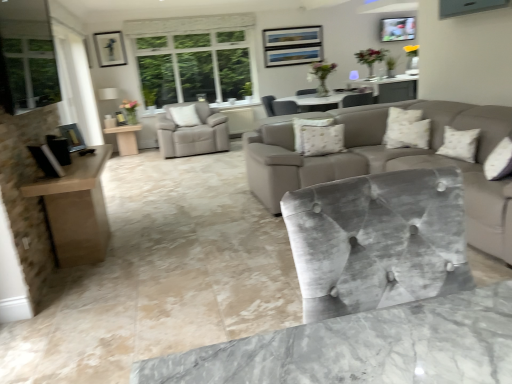
What is the approximate height of clear glass window at left?

clear glass window at left is 85.98 centimeters in height.

This screenshot has height=384, width=512. Describe the element at coordinates (185, 116) in the screenshot. I see `beige fabric pillow at center, positioned as the 1th pillow in back-to-front order` at that location.

Describe the element at coordinates (193, 133) in the screenshot. I see `light beige leather armchair at center, which is the 3th chair in bottom-to-top order` at that location.

In order to face metallic silver picture frame at upper right, which is the 2th picture frame in front-to-back order, should I rotate leftwards or rightwards?

Turn right approximately 18.273 degrees to face it.

Where is `matte beige table at center`? Image resolution: width=512 pixels, height=384 pixels. matte beige table at center is located at coordinates (125, 138).

What do you see at coordinates (125, 138) in the screenshot? This screenshot has height=384, width=512. I see `matte beige table at center` at bounding box center [125, 138].

Locate an element on the screen. This screenshot has height=384, width=512. clear glass window at left is located at coordinates (31, 72).

From a real-world perspective, which is physically below, velvet grey chair at center, the 2th chair when ordered from front to back, or white textured pillow at center, which is the second pillow in front-to-back order?

white textured pillow at center, which is the second pillow in front-to-back order.

Considering the sizes of velvet grey chair at center, the 2th chair when ordered from front to back, and white textured pillow at center, the third pillow in the top-to-bottom sequence, in the image, is velvet grey chair at center, the 2th chair when ordered from front to back, taller or shorter than white textured pillow at center, the third pillow in the top-to-bottom sequence,?

Clearly, velvet grey chair at center, the 2th chair when ordered from front to back, is shorter compared to white textured pillow at center, the third pillow in the top-to-bottom sequence.

Could you tell me if velvet grey chair at center, placed as the 3th chair when sorted from left to right, is facing white textured pillow at center, the 2th pillow positioned from the left?

No, velvet grey chair at center, placed as the 3th chair when sorted from left to right, is not oriented towards white textured pillow at center, the 2th pillow positioned from the left.

Based on the photo, is velvet grey chair at center, positioned as the second chair in bottom-to-top order, to the right of white textured pillow at center, the first pillow when ordered from bottom to top, from the viewer's perspective?

No, velvet grey chair at center, positioned as the second chair in bottom-to-top order, is not to the right of white textured pillow at center, the first pillow when ordered from bottom to top.

Which object is more forward, velvet gray chair at center, placed as the second chair when sorted from left to right, or matte black picture frame at upper left, placed as the 1th picture frame when sorted from bottom to top?

Positioned in front is velvet gray chair at center, placed as the second chair when sorted from left to right.

From their relative heights in the image, would you say velvet gray chair at center, the 3th chair viewed from the back, is taller or shorter than matte black picture frame at upper left, arranged as the second picture frame when viewed from the back?

In the image, velvet gray chair at center, the 3th chair viewed from the back, appears to be taller than matte black picture frame at upper left, arranged as the second picture frame when viewed from the back.

Identify the location of picture frame on the left of velvet gray chair at center, arranged as the 3th chair when viewed from the top. This screenshot has height=384, width=512. coord(110,49).

Does velvet gray chair at center, which appears as the first chair when viewed from the front, turn towards matte black picture frame at upper left, which is the first picture frame in left-to-right order?

No, velvet gray chair at center, which appears as the first chair when viewed from the front, is not facing towards matte black picture frame at upper left, which is the first picture frame in left-to-right order.

Can you confirm if white textured pillow at center, the 2th pillow positioned from the left, is positioned to the right of velvet grey chair at center, the second chair in the back-to-front sequence?

Correct, you'll find white textured pillow at center, the 2th pillow positioned from the left, to the right of velvet grey chair at center, the second chair in the back-to-front sequence.

Where is `the 1st chair to the left of the white textured pillow at center, the first pillow when ordered from bottom to top, starting your count from the anchor`? This screenshot has height=384, width=512. the 1st chair to the left of the white textured pillow at center, the first pillow when ordered from bottom to top, starting your count from the anchor is located at coordinates (278, 106).

From the image's perspective, which one is positioned lower, white textured pillow at center, the third pillow in the top-to-bottom sequence, or velvet grey chair at center, the 2th chair from the top?

white textured pillow at center, the third pillow in the top-to-bottom sequence, appears lower in the image.

Considering the sizes of objects white textured pillow at center, the 2th pillow positioned from the left, and velvet grey chair at center, the second chair in the back-to-front sequence, in the image provided, who is bigger, white textured pillow at center, the 2th pillow positioned from the left, or velvet grey chair at center, the second chair in the back-to-front sequence,?

Bigger between the two is velvet grey chair at center, the second chair in the back-to-front sequence.

From the image's perspective, would you say clear glass window at left is positioned over beige fabric pillow at center, arranged as the 3th pillow when viewed from the right?

No, from the image's perspective, clear glass window at left is not over beige fabric pillow at center, arranged as the 3th pillow when viewed from the right.

Measure the distance from clear glass window at left to beige fabric pillow at center, marked as the 3th pillow in a bottom-to-top arrangement.

clear glass window at left and beige fabric pillow at center, marked as the 3th pillow in a bottom-to-top arrangement, are 2.15 meters apart from each other.

Could beige fabric pillow at center, arranged as the 3th pillow when viewed from the right, be considered to be inside clear glass window at left?

No, beige fabric pillow at center, arranged as the 3th pillow when viewed from the right, is not surrounded by clear glass window at left.

Is point (34, 84) behind point (170, 110)?

No, it is in front of (170, 110).

Between light beige leather armchair at center, the 3th chair viewed from the front, and clear glass window at left, which one has larger size?

Bigger between the two is clear glass window at left.

Is light beige leather armchair at center, which is the 3th chair in bottom-to-top order, spatially inside clear glass window at left, or outside of it?

light beige leather armchair at center, which is the 3th chair in bottom-to-top order, cannot be found inside clear glass window at left.

Considering the relative sizes of velvet grey chair at center, the second chair in the back-to-front sequence, and matte black picture frame at upper left, arranged as the second picture frame when viewed from the back, in the image provided, is velvet grey chair at center, the second chair in the back-to-front sequence, taller than matte black picture frame at upper left, arranged as the second picture frame when viewed from the back,?

In fact, velvet grey chair at center, the second chair in the back-to-front sequence, may be shorter than matte black picture frame at upper left, arranged as the second picture frame when viewed from the back.

Can you confirm if velvet grey chair at center, the second chair in the back-to-front sequence, is positioned to the left of matte black picture frame at upper left, placed as the 1th picture frame when sorted from bottom to top?

In fact, velvet grey chair at center, the second chair in the back-to-front sequence, is to the right of matte black picture frame at upper left, placed as the 1th picture frame when sorted from bottom to top.

Which is in front, velvet grey chair at center, the second chair in the back-to-front sequence, or matte black picture frame at upper left, placed as the 1th picture frame when sorted from bottom to top?

velvet grey chair at center, the second chair in the back-to-front sequence, is closer to the camera.

How many degrees apart are the facing directions of velvet grey chair at center, the 2th chair from the top, and matte black picture frame at upper left, placed as the 1th picture frame when sorted from bottom to top?

112 degrees separate the facing orientations of velvet grey chair at center, the 2th chair from the top, and matte black picture frame at upper left, placed as the 1th picture frame when sorted from bottom to top.

Is point (42, 44) positioned before point (137, 148)?

Yes, it is in front of point (137, 148).

Does clear glass window at left have a larger size compared to matte beige table at center?

Yes, clear glass window at left is bigger than matte beige table at center.

Is clear glass window at left facing towards matte beige table at center?

No.

Are clear glass window at left and matte beige table at center beside each other?

They are not placed beside each other.

There is a white textured pillow at center, which is the second pillow in front-to-back order. Identify the location of the 2nd chair above it (from a real-world perspective). (278, 106).

The height and width of the screenshot is (384, 512). I want to click on the 2nd chair counting from the right of the matte black picture frame at upper left, which is the first picture frame in left-to-right order, so click(377, 241).

Considering their positions, is velvet grey chair at center, the 2th chair when ordered from front to back, positioned further to matte beige table at center than clear glass window at left?

velvet grey chair at center, the 2th chair when ordered from front to back, is further to matte beige table at center.

When comparing their distances from velvet grey chair at center, the second chair in the back-to-front sequence, does velvet gray chair at center, the 3th chair viewed from the back, or white textured pillow at upper right, which is counted as the 3th pillow, starting from the left, seem further?

Based on the image, velvet gray chair at center, the 3th chair viewed from the back, appears to be further to velvet grey chair at center, the second chair in the back-to-front sequence.

When comparing their distances from velvet gray chair at center, placed as the second chair when sorted from left to right, does beige fabric pillow at center, marked as the 1th pillow in a left-to-right arrangement, or clear glass window at left seem further?

The object further to velvet gray chair at center, placed as the second chair when sorted from left to right, is beige fabric pillow at center, marked as the 1th pillow in a left-to-right arrangement.

Considering their positions, is velvet grey chair at center, placed as the 3th chair when sorted from left to right, positioned further to clear glass window at left than white textured pillow at upper right, the 1th pillow positioned from the right?

Based on the image, white textured pillow at upper right, the 1th pillow positioned from the right, appears to be further to clear glass window at left.

Which object lies nearer to the anchor point beige fabric pillow at center, marked as the 1th pillow in a left-to-right arrangement, matte beige table at center or white textured pillow at upper right, the second pillow in the top-to-bottom sequence?

matte beige table at center.

From the image, which object appears to be farther from matte black picture frame at upper left, arranged as the second picture frame when viewed from the top, white textured pillow at center, which is counted as the second pillow, starting from the back, or light beige leather armchair at center, the 3th chair viewed from the front?

white textured pillow at center, which is counted as the second pillow, starting from the back, lies further to matte black picture frame at upper left, arranged as the second picture frame when viewed from the top, than the other object.

Based on their spatial positions, is metallic silver picture frame at upper right, arranged as the 1th picture frame when viewed from the top, or matte black picture frame at upper left, which is the first picture frame from front to back, closer to beige fabric pillow at center, the 1th pillow from the top?

matte black picture frame at upper left, which is the first picture frame from front to back, is positioned closer to the anchor beige fabric pillow at center, the 1th pillow from the top.

From the image, which object appears to be nearer to clear glass window at left, metallic silver picture frame at upper right, arranged as the 1th picture frame when viewed from the top, or velvet grey chair at center, positioned as the second chair in bottom-to-top order?

velvet grey chair at center, positioned as the second chair in bottom-to-top order, is closer to clear glass window at left.

Identify the location of chair between white textured pillow at center, which is counted as the second pillow, starting from the back, and light beige leather armchair at center, which is the 3th chair in bottom-to-top order, in the front-back direction. (278, 106).

Where is `pillow between velvet grey chair at center, positioned as the second chair in bottom-to-top order, and light beige leather armchair at center, which is the 3th chair in bottom-to-top order, from front to back`? The image size is (512, 384). pillow between velvet grey chair at center, positioned as the second chair in bottom-to-top order, and light beige leather armchair at center, which is the 3th chair in bottom-to-top order, from front to back is located at coordinates (185, 116).

At what (x,y) coordinates should I click in order to perform the action: click on table between matte black picture frame at upper left, arranged as the second picture frame when viewed from the top, and metallic silver picture frame at upper right, acting as the 2th picture frame starting from the left. Please return your answer as a coordinate pair (x, y). The height and width of the screenshot is (384, 512). Looking at the image, I should click on (125, 138).

This screenshot has height=384, width=512. I want to click on table located between matte black picture frame at upper left, placed as the 1th picture frame when sorted from bottom to top, and white textured pillow at upper right, the first pillow positioned from the front, in the left-right direction, so click(125, 138).